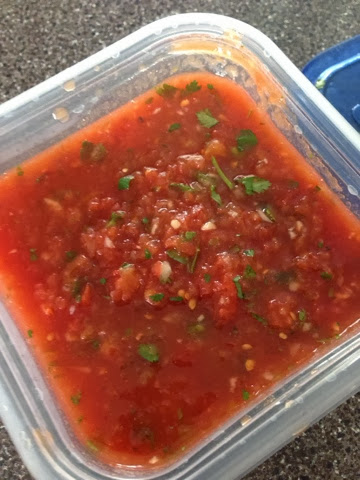
At what (x,y) coordinates should I click in order to perform the action: click on top corner of tub. Please return your answer as a coordinate pair (x, y). The height and width of the screenshot is (480, 360). Looking at the image, I should click on coord(197,24).